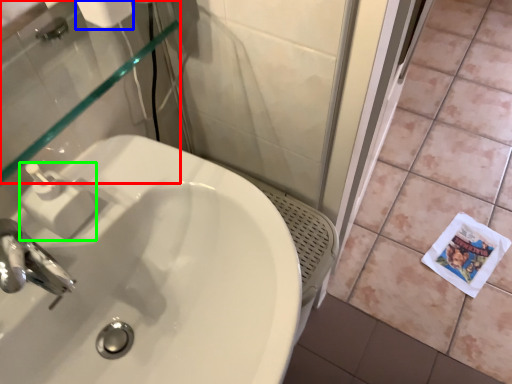
Question: Considering the real-world distances, which object is closest to mirror (highlighted by a red box)? toilet paper (highlighted by a blue box) or soap dispenser (highlighted by a green box).

Choices:
 (A) toilet paper
 (B) soap dispenser

Answer: (B)